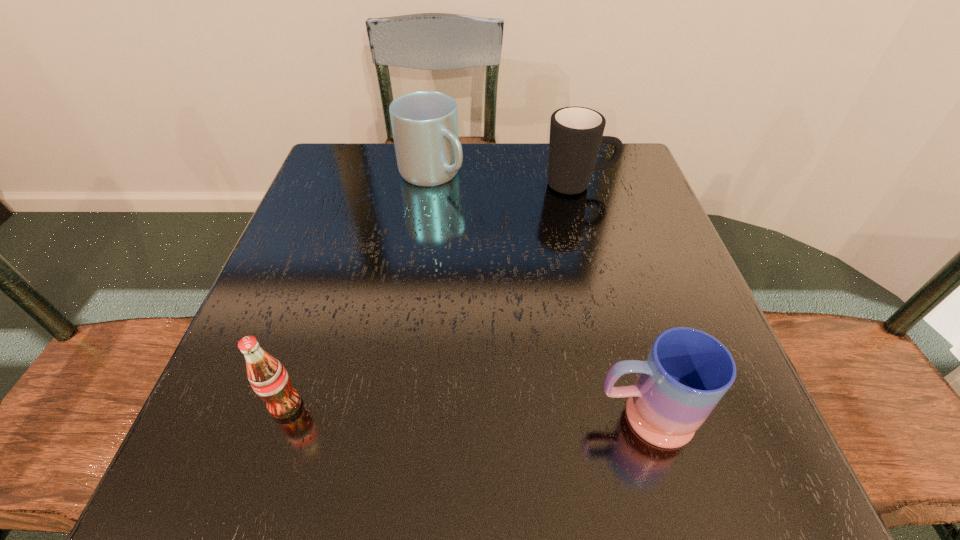
Where is `object that is at the far right corner`? Image resolution: width=960 pixels, height=540 pixels. object that is at the far right corner is located at coordinates (576, 133).

This screenshot has width=960, height=540. Find the location of `object that is at the near right corner`. object that is at the near right corner is located at coordinates (687, 372).

Where is `free space at the near edge of the desktop`? This screenshot has height=540, width=960. free space at the near edge of the desktop is located at coordinates (557, 437).

Locate an element on the screen. The image size is (960, 540). vacant area at the left edge of the desktop is located at coordinates (372, 208).

What are the coordinates of `vacant space at the right edge of the desktop` in the screenshot? It's located at (626, 343).

This screenshot has height=540, width=960. I want to click on free location at the far left corner of the desktop, so click(373, 156).

The height and width of the screenshot is (540, 960). In the image, there is a desktop. In order to click on vacant space at the near left corner in this screenshot , I will do `click(273, 449)`.

Locate an element on the screen. This screenshot has height=540, width=960. free space at the far right corner is located at coordinates (633, 159).

This screenshot has width=960, height=540. Identify the location of empty space between the third object from right to left and the soda. (359, 289).

Locate an element on the screen. This screenshot has width=960, height=540. empty space between the leftmost mug and the nearest mug is located at coordinates (538, 295).